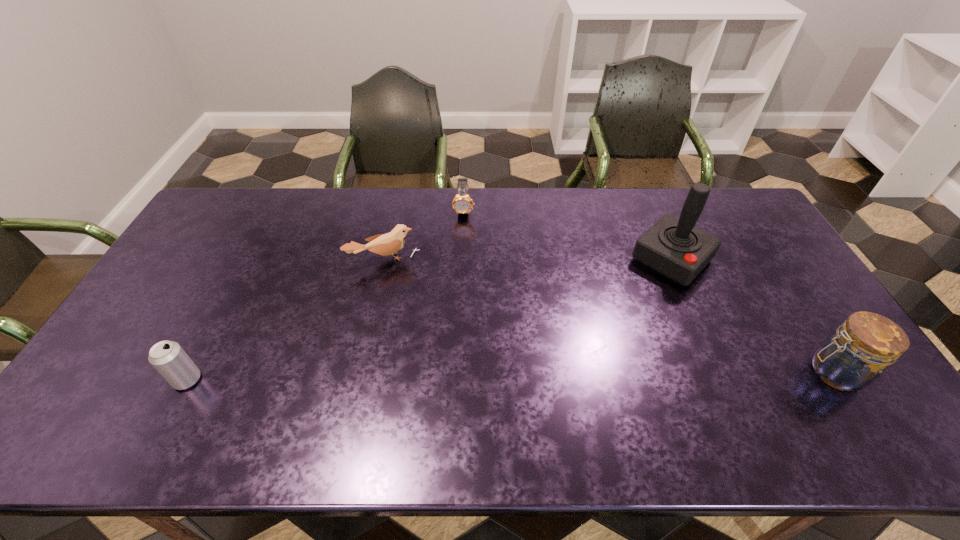
At what (x,y) coordinates should I click in order to perform the action: click on free space located 0.280m on the face of the watch. Please return your answer as a coordinate pair (x, y). The height and width of the screenshot is (540, 960). Looking at the image, I should click on tap(463, 277).

Identify the location of object at the far edge. The height and width of the screenshot is (540, 960). (462, 203).

Identify the location of beer can that is positioned at the near edge. (167, 357).

Where is `jar located at the near edge`? The width and height of the screenshot is (960, 540). jar located at the near edge is located at coordinates (852, 358).

Where is `object that is at the right edge`? The width and height of the screenshot is (960, 540). object that is at the right edge is located at coordinates (852, 358).

The image size is (960, 540). I want to click on object that is at the near right corner, so click(852, 358).

Where is `vacant space at the far edge`? The width and height of the screenshot is (960, 540). vacant space at the far edge is located at coordinates (441, 213).

Where is `free spot at the near edge of the desktop`? free spot at the near edge of the desktop is located at coordinates (621, 402).

Find the location of a particular element. free space at the left edge of the desktop is located at coordinates (216, 260).

Find the location of a particular element. free location at the right edge of the desktop is located at coordinates (775, 327).